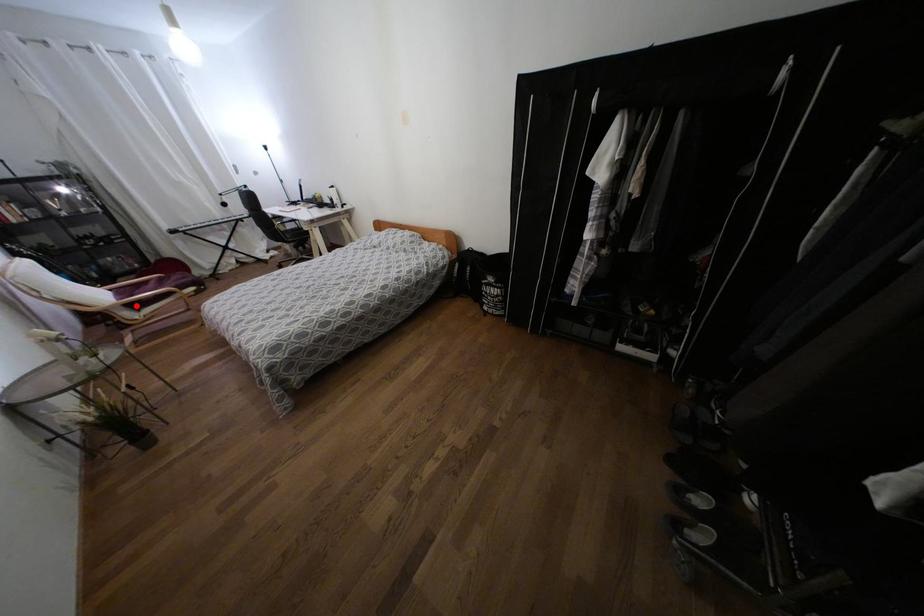
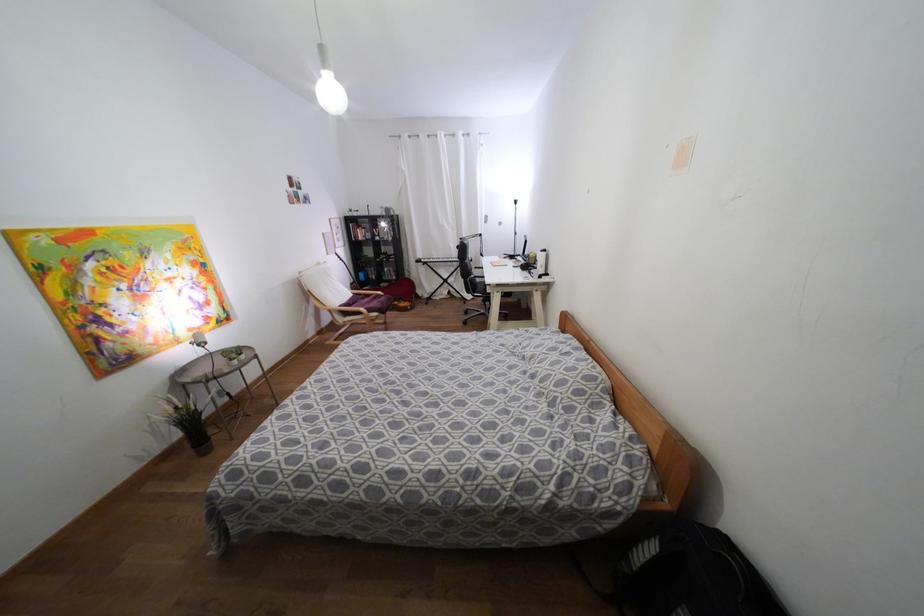
Locate, in the second image, the point that corresponds to the highlighted location in the first image.

(344, 313)